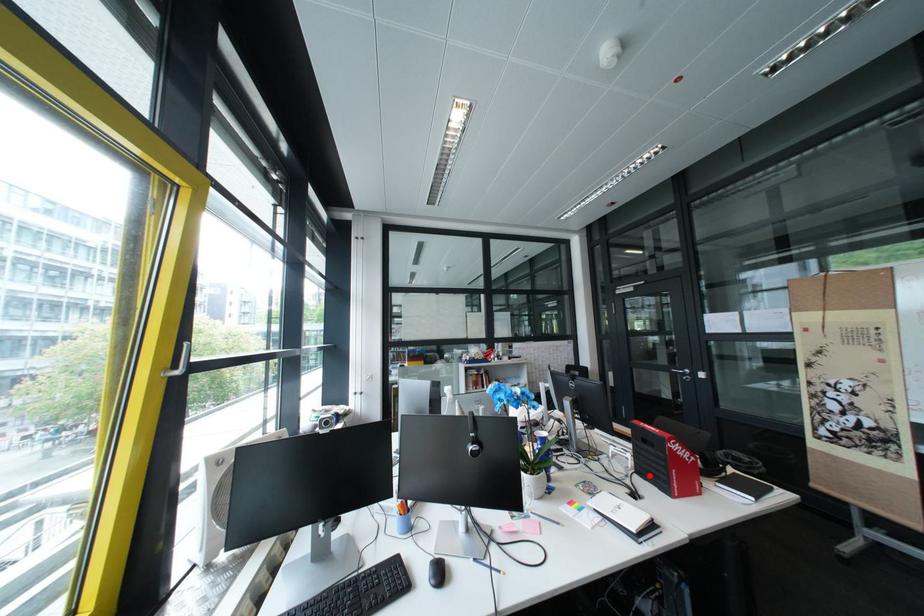
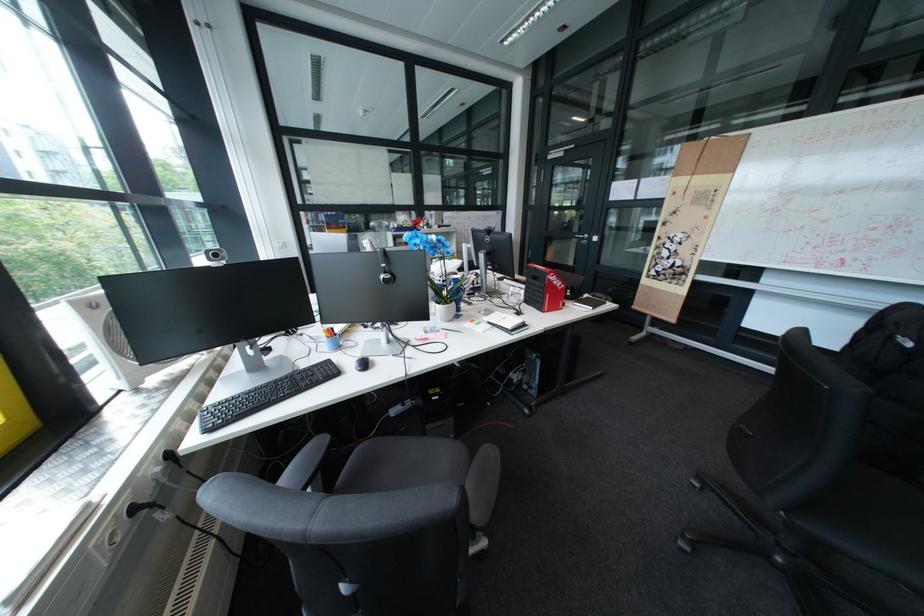
Locate, in the second image, the point that corresponds to the highlighted location in the first image.

(538, 304)